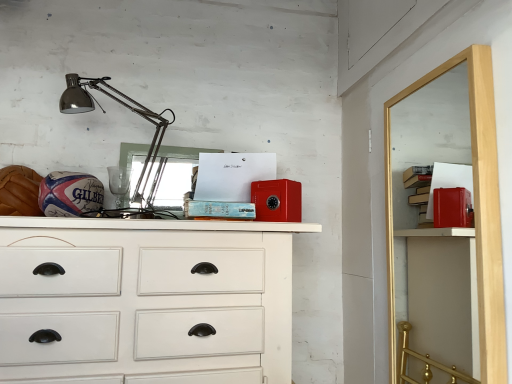
Question: Considering the relative sizes of white painted wood chest of drawers at center and metallic silver lamp at upper left in the image provided, is white painted wood chest of drawers at center smaller than metallic silver lamp at upper left?

Choices:
 (A) yes
 (B) no

Answer: (B)

Question: Considering the relative positions of white painted wood chest of drawers at center and metallic silver lamp at upper left in the image provided, is white painted wood chest of drawers at center to the left of metallic silver lamp at upper left from the viewer's perspective?

Choices:
 (A) no
 (B) yes

Answer: (A)

Question: Considering the relative sizes of white painted wood chest of drawers at center and metallic silver lamp at upper left in the image provided, is white painted wood chest of drawers at center taller than metallic silver lamp at upper left?

Choices:
 (A) no
 (B) yes

Answer: (B)

Question: Is white painted wood chest of drawers at center shorter than metallic silver lamp at upper left?

Choices:
 (A) yes
 (B) no

Answer: (B)

Question: Does white painted wood chest of drawers at center have a lesser width compared to metallic silver lamp at upper left?

Choices:
 (A) yes
 (B) no

Answer: (B)

Question: From their relative heights in the image, would you say metallic silver lamp at upper left is taller or shorter than white painted wood chest of drawers at center?

Choices:
 (A) short
 (B) tall

Answer: (A)

Question: Would you say metallic silver lamp at upper left is to the left or to the right of white painted wood chest of drawers at center in the picture?

Choices:
 (A) right
 (B) left

Answer: (B)

Question: In the image, is metallic silver lamp at upper left positioned in front of or behind white painted wood chest of drawers at center?

Choices:
 (A) behind
 (B) front

Answer: (A)

Question: Is metallic silver lamp at upper left situated inside white painted wood chest of drawers at center or outside?

Choices:
 (A) inside
 (B) outside

Answer: (B)

Question: Is red matte safe at upper right wider or thinner than metallic silver lamp at upper left?

Choices:
 (A) wide
 (B) thin

Answer: (B)

Question: From a real-world perspective, is red matte safe at upper right positioned above or below metallic silver lamp at upper left?

Choices:
 (A) above
 (B) below

Answer: (B)

Question: Is red matte safe at upper right taller or shorter than metallic silver lamp at upper left?

Choices:
 (A) short
 (B) tall

Answer: (B)

Question: Is red matte safe at upper right inside the boundaries of metallic silver lamp at upper left, or outside?

Choices:
 (A) outside
 (B) inside

Answer: (A)

Question: Is point (497, 170) closer or farther from the camera than point (253, 261)?

Choices:
 (A) closer
 (B) farther

Answer: (A)

Question: Relative to white painted wood chest of drawers at center, is red matte safe at upper right in front or behind?

Choices:
 (A) front
 (B) behind

Answer: (A)